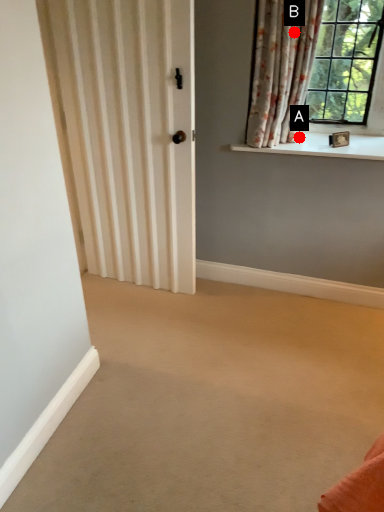
Question: Two points are circled on the image, labeled by A and B beside each circle. Which of the following is the closest to the observer?

Choices:
 (A) A is closer
 (B) B is closer

Answer: (B)